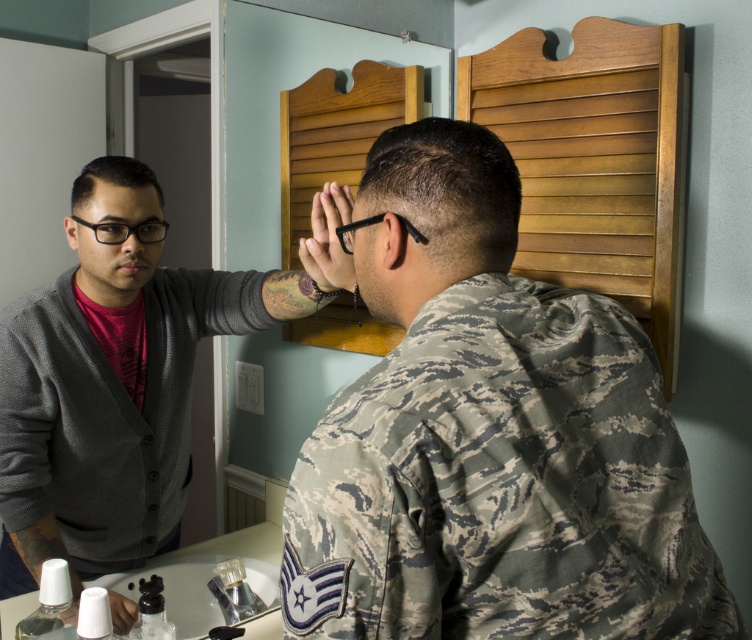
Locate an element on the screen. This screenshot has height=640, width=752. dark brown matte hair at center is located at coordinates (447, 189).

Measure the distance between point (441, 211) and camera.

They are 28.09 inches apart.

Image resolution: width=752 pixels, height=640 pixels. I want to click on dark brown matte hair at center, so click(447, 189).

From the picture: Between camouflage fabric uniform at center and gray matte cardigan at left, which one is positioned higher?

camouflage fabric uniform at center

Is camouflage fabric uniform at center below gray matte cardigan at left?

Actually, camouflage fabric uniform at center is above gray matte cardigan at left.

The height and width of the screenshot is (640, 752). Find the location of `camouflage fabric uniform at center`. camouflage fabric uniform at center is located at coordinates (490, 436).

Which is more to the left, gray matte cardigan at left or dark brown hair at left?

Positioned to the left is dark brown hair at left.

Describe the element at coordinates (123, 381) in the screenshot. I see `gray matte cardigan at left` at that location.

Measure the distance between gray matte cardigan at left and camera.

gray matte cardigan at left is 35.36 inches away from camera.

The height and width of the screenshot is (640, 752). In order to click on gray matte cardigan at left in this screenshot , I will do `click(123, 381)`.